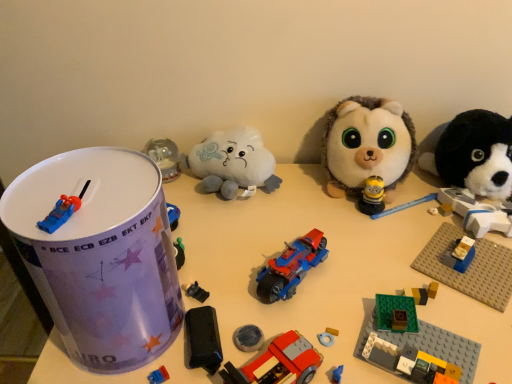
Find the location of a particular element. The height and width of the screenshot is (384, 512). free area in between fluffy white plush at center, the 8th toy when ordered from left to right, and white plush cloud at center, which is the third toy in left-to-right order is located at coordinates (285, 193).